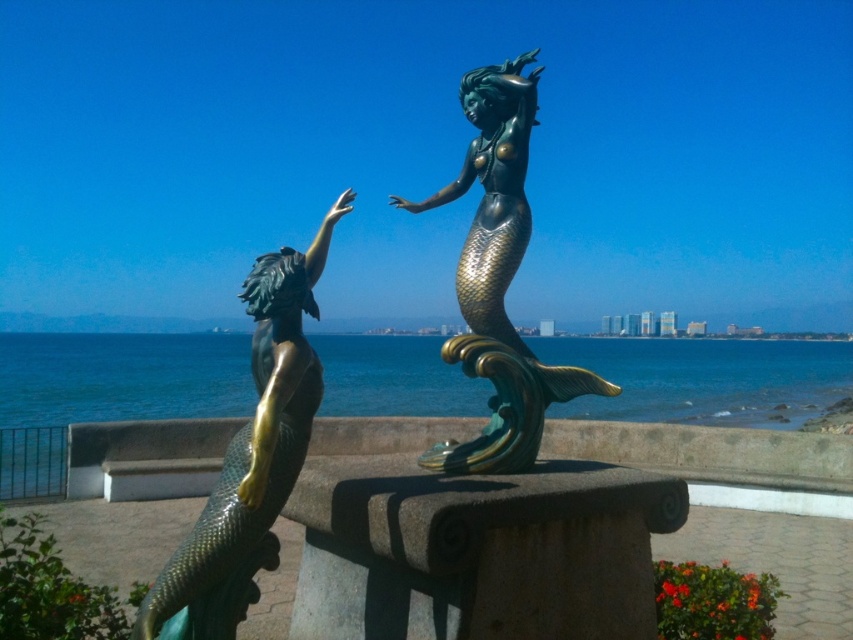
You are a sculptor who wants to place a small plaque between the green patina mermaid at center and the bronze mermaid at center. The plaque is 15 centimeters wide. Is there enough space between them to fit the plaque?

The green patina mermaid at center and bronze mermaid at center are 67.70 centimeters apart from each other, so yes, there is enough space between them to fit a 15 centimeter wide plaque.